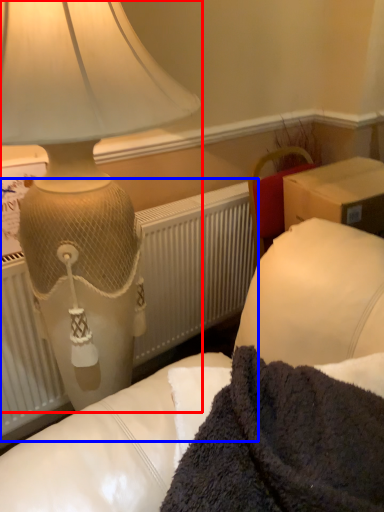
Question: Among these objects, which one is farthest to the camera, lamp (highlighted by a red box) or radiator (highlighted by a blue box)?

Choices:
 (A) lamp
 (B) radiator

Answer: (B)